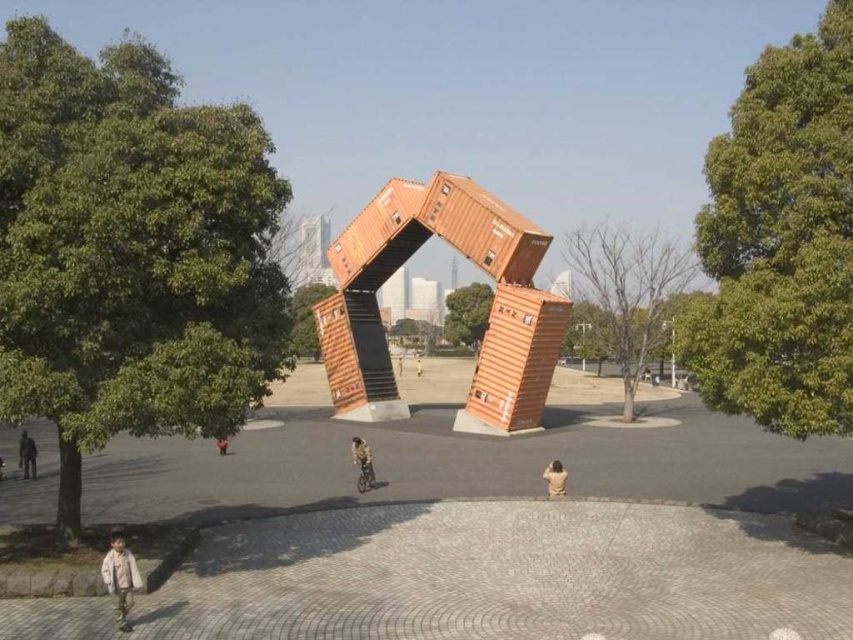
Question: Which point is farther to the camera?

Choices:
 (A) orange matte shipping container at center
 (B) yellow fabric jacket at center
 (C) light brown leather jacket at lower center
 (D) yellow fabric person at center

Answer: (D)

Question: Is green leafy tree at left positioned at the back of light brown leather jacket at lower center?

Choices:
 (A) yes
 (B) no

Answer: (B)

Question: Can you confirm if green leafy tree at left is positioned below brown wooden tree at center?

Choices:
 (A) no
 (B) yes

Answer: (A)

Question: From the image, what is the correct spatial relationship of orange matte shipping container at center in relation to light brown wooden bench at center?

Choices:
 (A) below
 (B) above

Answer: (B)

Question: Among these objects, which one is farthest from the camera?

Choices:
 (A) bare wood tree at center
 (B) yellow fabric jacket at center
 (C) light brown wooden bench at center

Answer: (C)

Question: Estimate the real-world distances between objects in this image. Which object is farther from the brown wooden tree at center?

Choices:
 (A) yellow fabric jacket at center
 (B) yellow fabric person at center
 (C) light brown hair at center
 (D) light brown leather jacket at lower center

Answer: (A)